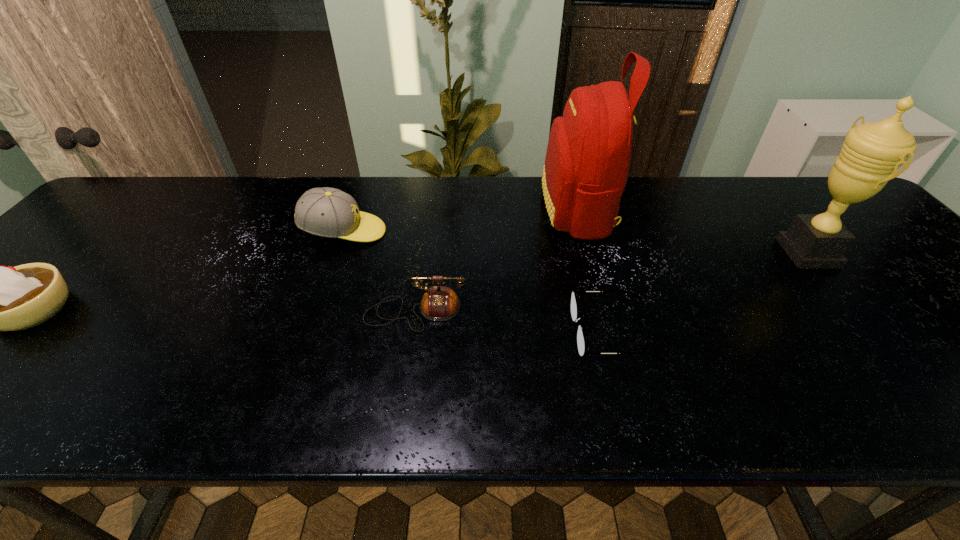
The image size is (960, 540). Identify the location of backpack. (587, 161).

Identify the location of the rightmost object. The image size is (960, 540). (871, 154).

Locate an element on the screen. This screenshot has height=540, width=960. baseball cap is located at coordinates (327, 212).

Where is `telephone`? telephone is located at coordinates (439, 303).

Find the location of a particular element. spectacles is located at coordinates (574, 311).

Find the location of `vacant space situated on the front-facing side of the backpack`. vacant space situated on the front-facing side of the backpack is located at coordinates (422, 210).

Identify the location of vacant region located 0.270m on the front-facing side of the backpack. (447, 210).

Image resolution: width=960 pixels, height=540 pixels. In order to click on free region located on the front-facing side of the backpack in this screenshot , I will do `click(499, 210)`.

Where is `blank space located 0.280m at the front of the rightmost object with handles`? The image size is (960, 540). blank space located 0.280m at the front of the rightmost object with handles is located at coordinates click(x=674, y=253).

Find the location of a particular element. The image size is (960, 540). vacant space located 0.180m at the front of the rightmost object with handles is located at coordinates (713, 253).